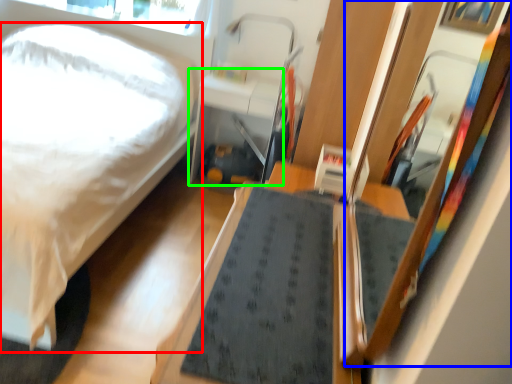
Question: Considering the real-world distances, which object is closest to bed (highlighted by a red box)? mirror (highlighted by a blue box) or table (highlighted by a green box).

Choices:
 (A) mirror
 (B) table

Answer: (B)